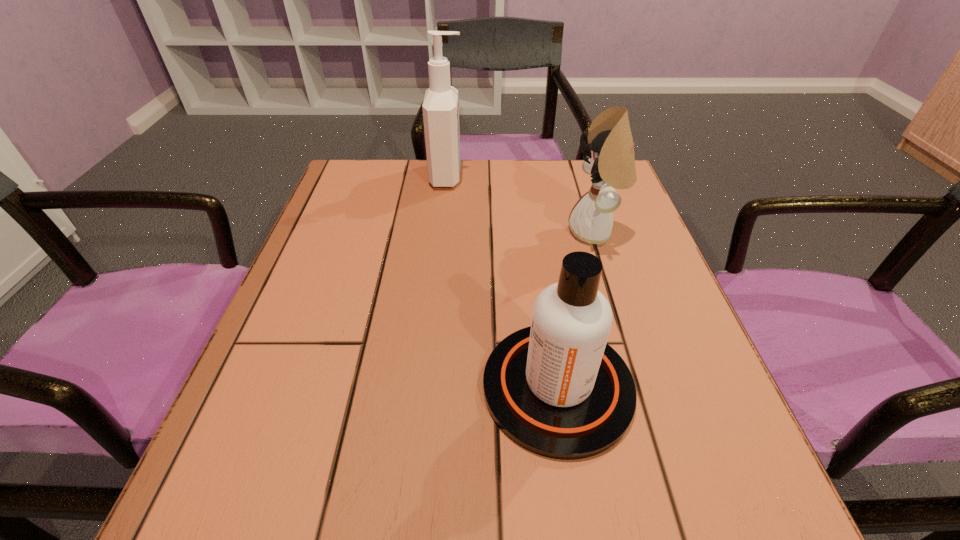
Find the location of a particular element. Image resolution: width=960 pixels, height=540 pixels. vacant area that lies between the leftmost object and the shorter cleansing agent is located at coordinates (502, 281).

Where is `vacant area that lies between the farther cleansing agent and the second nearest object`? vacant area that lies between the farther cleansing agent and the second nearest object is located at coordinates (521, 204).

Find the location of a particular element. The width and height of the screenshot is (960, 540). vacant point located between the doll and the left cleansing agent is located at coordinates pos(521,204).

I want to click on empty space that is in between the farther cleansing agent and the right cleansing agent, so 502,281.

Locate an element on the screen. This screenshot has width=960, height=540. vacant space that is in between the tallest object and the nearest object is located at coordinates (502, 281).

Find the location of a particular element. empty space that is in between the doll and the taller cleansing agent is located at coordinates (521, 204).

Locate an element on the screen. free point between the farthest object and the doll is located at coordinates (521, 204).

Where is `object that is the nearest to the second farthest object`? The image size is (960, 540). object that is the nearest to the second farthest object is located at coordinates (557, 389).

Choose which object is the nearest neighbor to the second nearest object. Please provide its 2D coordinates. Your answer should be formatted as a tuple, i.e. [(x, y)], where the tuple contains the x and y coordinates of a point satisfying the conditions above.

[(557, 389)]

Locate an element on the screen. This screenshot has width=960, height=540. free space in the image that satisfies the following two spatial constraints: 1. on the front label of the nearer cleansing agent; 2. on the left side of the taller cleansing agent is located at coordinates (425, 387).